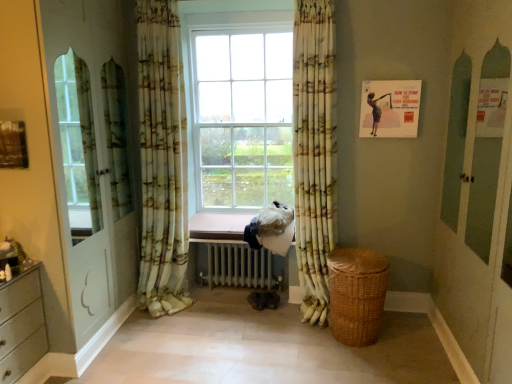
Describe the element at coordinates (239, 265) in the screenshot. I see `white metallic radiator at center` at that location.

Measure the distance between point (x=208, y=223) and camera.

Point (x=208, y=223) and camera are 12.40 feet apart.

Describe the element at coordinates (218, 226) in the screenshot. I see `pink wood at center` at that location.

Where is `yellow-green floral fabric curtain at center, positioned as the 1th curtain in right-to-left order`? yellow-green floral fabric curtain at center, positioned as the 1th curtain in right-to-left order is located at coordinates (314, 150).

What do you see at coordinates (314, 150) in the screenshot?
I see `yellow-green floral fabric curtain at center, the second curtain when ordered from left to right` at bounding box center [314, 150].

You are a GUI agent. You are given a task and a screenshot of the screen. Output one action in this format:
    pyautogui.click(x=<x>, y=<y>)
    Task: Click on the white metallic radiator at center
    
    Given the screenshot: What is the action you would take?
    pyautogui.click(x=239, y=265)

How much distance is there between pink wood at center and matte paper poster at upper right?

pink wood at center is 4.81 feet away from matte paper poster at upper right.

What's the angular difference between pink wood at center and matte paper poster at upper right's facing directions?

They differ by 1.15 degrees in their facing directions.

Which of these two, pink wood at center or matte paper poster at upper right, is wider?

Wider between the two is pink wood at center.

Between pink wood at center and matte paper poster at upper right, which one is positioned in front?

matte paper poster at upper right.

Is yellow-green floral fabric curtain at center, the second curtain when ordered from left to right, smaller than woven brown basket at lower right?

No.

From a real-world perspective, is yellow-green floral fabric curtain at center, the second curtain when ordered from left to right, physically above woven brown basket at lower right?

Yes, from a real-world perspective, yellow-green floral fabric curtain at center, the second curtain when ordered from left to right, is above woven brown basket at lower right.

Is yellow-green floral fabric curtain at center, the second curtain when ordered from left to right, facing away from woven brown basket at lower right?

yellow-green floral fabric curtain at center, the second curtain when ordered from left to right, is not turned away from woven brown basket at lower right.

Considering the points (197, 234) and (340, 250), which point is in front, point (197, 234) or point (340, 250)?

Point (340, 250)

Do you think pink wood at center is within woven brown basket at lower right, or outside of it?

pink wood at center is not enclosed by woven brown basket at lower right.

How different are the orientations of pink wood at center and woven brown basket at lower right in degrees?

There is a 4.25-degree angle between the facing directions of pink wood at center and woven brown basket at lower right.

Looking at this image, which is correct: woven brown basket at lower right is inside yellow-green floral fabric curtain at center, the second curtain when ordered from left to right, or outside of it?

woven brown basket at lower right is located beyond the bounds of yellow-green floral fabric curtain at center, the second curtain when ordered from left to right.

Is woven brown basket at lower right oriented towards yellow-green floral fabric curtain at center, positioned as the 1th curtain in right-to-left order?

No, woven brown basket at lower right is not oriented towards yellow-green floral fabric curtain at center, positioned as the 1th curtain in right-to-left order.

Is point (348, 279) farther from viewer compared to point (329, 99)?

No.

How much distance is there between woven brown basket at lower right and yellow-green floral fabric curtain at center, the second curtain when ordered from left to right?

woven brown basket at lower right is 18.93 inches away from yellow-green floral fabric curtain at center, the second curtain when ordered from left to right.

Between pink wood at center and white metallic radiator at center, which one is positioned behind?

white metallic radiator at center is behind.

Looking at their sizes, would you say pink wood at center is wider or thinner than white metallic radiator at center?

pink wood at center is thinner than white metallic radiator at center.

Is white metallic radiator at center surrounded by pink wood at center?

No, white metallic radiator at center is not a part of pink wood at center.

Is pink wood at center shorter than white metallic radiator at center?

Yes.

Which of these two, woven brown basket at lower right or matte paper poster at upper right, is wider?

Wider between the two is woven brown basket at lower right.

You are a GUI agent. You are given a task and a screenshot of the screen. Output one action in this format:
    pyautogui.click(x=<x>, y=<y>)
    Task: Click on the basket that is below the matte paper poster at upper right (from the image's perspective)
    This screenshot has width=512, height=384.
    Given the screenshot: What is the action you would take?
    pyautogui.click(x=356, y=295)

Is woven brown basket at lower right facing towards matte paper poster at upper right?

No, woven brown basket at lower right is not facing towards matte paper poster at upper right.

Can matte paper poster at upper right be found inside woven brown basket at lower right?

No, woven brown basket at lower right does not contain matte paper poster at upper right.

How many degrees apart are the facing directions of yellow-green floral fabric curtain at center, positioned as the 1th curtain in right-to-left order, and white metallic radiator at center?

89.9 degrees.

Is the surface of yellow-green floral fabric curtain at center, positioned as the 1th curtain in right-to-left order, in direct contact with white metallic radiator at center?

There is a gap between yellow-green floral fabric curtain at center, positioned as the 1th curtain in right-to-left order, and white metallic radiator at center.

Which is farther from the camera, (308, 218) or (222, 267)?

The point (222, 267) is more distant.

From the image's perspective, between yellow-green floral fabric curtain at center, the second curtain when ordered from left to right, and white metallic radiator at center, who is located below?

From the image's view, white metallic radiator at center is below.

At what (x,y) coordinates should I click in order to perform the action: click on window sill behind the matte paper poster at upper right. Please return your answer as a coordinate pair (x, y). Looking at the image, I should click on (218, 226).

Where is `curtain that is the 1st one when counting leftward from the woven brown basket at lower right`? The height and width of the screenshot is (384, 512). curtain that is the 1st one when counting leftward from the woven brown basket at lower right is located at coordinates (314, 150).

When comparing their distances from yellow-green floral fabric curtain at center, positioned as the 1th curtain in right-to-left order, does printed fabric curtain at left, the second curtain when ordered from right to left, or pink wood at center seem closer?

pink wood at center lies closer to yellow-green floral fabric curtain at center, positioned as the 1th curtain in right-to-left order, than the other object.

Which object lies further to the anchor point woven brown basket at lower right, printed fabric curtain at left, the second curtain when ordered from right to left, or matte paper poster at upper right?

Based on the image, printed fabric curtain at left, the second curtain when ordered from right to left, appears to be further to woven brown basket at lower right.

From the image, which object appears to be farther from white metallic radiator at center, pink wood at center or matte paper poster at upper right?

matte paper poster at upper right is positioned further to the anchor white metallic radiator at center.

When comparing their distances from woven brown basket at lower right, does pink wood at center or yellow-green floral fabric curtain at center, positioned as the 1th curtain in right-to-left order, seem further?

pink wood at center.

Which object lies nearer to the anchor point yellow-green floral fabric curtain at center, positioned as the 1th curtain in right-to-left order, printed fabric curtain at left, the second curtain when ordered from right to left, or woven brown basket at lower right?

Based on the image, woven brown basket at lower right appears to be nearer to yellow-green floral fabric curtain at center, positioned as the 1th curtain in right-to-left order.

When comparing their distances from woven brown basket at lower right, does yellow-green floral fabric curtain at center, positioned as the 1th curtain in right-to-left order, or printed fabric curtain at left, the second curtain when ordered from right to left, seem closer?

yellow-green floral fabric curtain at center, positioned as the 1th curtain in right-to-left order, is closer to woven brown basket at lower right.

Which object lies nearer to the anchor point woven brown basket at lower right, printed fabric curtain at left, the second curtain when ordered from right to left, or white metallic radiator at center?

white metallic radiator at center is positioned closer to the anchor woven brown basket at lower right.

Which object lies further to the anchor point yellow-green floral fabric curtain at center, the second curtain when ordered from left to right, matte paper poster at upper right or white metallic radiator at center?

white metallic radiator at center is further to yellow-green floral fabric curtain at center, the second curtain when ordered from left to right.

The height and width of the screenshot is (384, 512). I want to click on radiator situated between printed fabric curtain at left, the second curtain when ordered from right to left, and woven brown basket at lower right from left to right, so click(239, 265).

Image resolution: width=512 pixels, height=384 pixels. I want to click on curtain between printed fabric curtain at left, the 1th curtain in the left-to-right sequence, and matte paper poster at upper right from left to right, so click(314, 150).

I want to click on window sill located between printed fabric curtain at left, the 1th curtain in the left-to-right sequence, and yellow-green floral fabric curtain at center, the second curtain when ordered from left to right, in the left-right direction, so click(218, 226).

The image size is (512, 384). What are the coordinates of `basket situated between printed fabric curtain at left, the 1th curtain in the left-to-right sequence, and matte paper poster at upper right from left to right` in the screenshot? It's located at (356, 295).